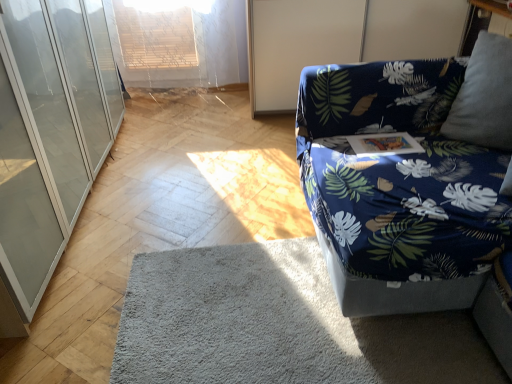
Question: Considering the relative sizes of blue fabric screen door at upper right and blue fabric couch at right in the image provided, is blue fabric screen door at upper right smaller than blue fabric couch at right?

Choices:
 (A) yes
 (B) no

Answer: (A)

Question: Is blue fabric screen door at upper right oriented towards blue fabric couch at right?

Choices:
 (A) no
 (B) yes

Answer: (B)

Question: Is blue fabric screen door at upper right in front of blue fabric couch at right?

Choices:
 (A) yes
 (B) no

Answer: (B)

Question: Is blue fabric screen door at upper right taller than blue fabric couch at right?

Choices:
 (A) yes
 (B) no

Answer: (A)

Question: Can you confirm if blue fabric screen door at upper right is shorter than blue fabric couch at right?

Choices:
 (A) no
 (B) yes

Answer: (A)

Question: Is blue fabric screen door at upper right next to blue fabric couch at right and touching it?

Choices:
 (A) yes
 (B) no

Answer: (B)

Question: Is blue fabric couch at right located within gray soft rug at lower center?

Choices:
 (A) yes
 (B) no

Answer: (B)

Question: Is gray soft rug at lower center outside blue fabric couch at right?

Choices:
 (A) no
 (B) yes

Answer: (B)

Question: Considering the relative sizes of gray soft rug at lower center and blue fabric couch at right in the image provided, is gray soft rug at lower center wider than blue fabric couch at right?

Choices:
 (A) yes
 (B) no

Answer: (A)

Question: From a real-world perspective, does gray soft rug at lower center sit lower than blue fabric couch at right?

Choices:
 (A) yes
 (B) no

Answer: (A)

Question: From the image's perspective, is gray soft rug at lower center beneath blue fabric couch at right?

Choices:
 (A) no
 (B) yes

Answer: (B)

Question: Can you confirm if gray soft rug at lower center is positioned to the right of blue fabric couch at right?

Choices:
 (A) no
 (B) yes

Answer: (A)

Question: Is gray soft rug at lower center located outside transparent glass cabinet at left?

Choices:
 (A) yes
 (B) no

Answer: (A)